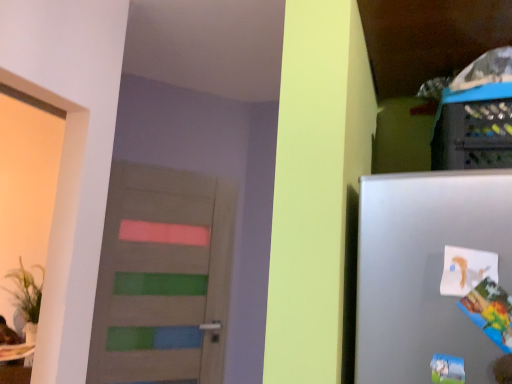
Question: Is wooden door with painted stripes at center to the left of colorful paper comic book at right from the viewer's perspective?

Choices:
 (A) no
 (B) yes

Answer: (B)

Question: From the image's perspective, is wooden door with painted stripes at center under colorful paper comic book at right?

Choices:
 (A) yes
 (B) no

Answer: (A)

Question: From a real-world perspective, is wooden door with painted stripes at center physically above colorful paper comic book at right?

Choices:
 (A) no
 (B) yes

Answer: (A)

Question: Does wooden door with painted stripes at center appear on the right side of colorful paper comic book at right?

Choices:
 (A) yes
 (B) no

Answer: (B)

Question: Would you say wooden door with painted stripes at center contains colorful paper comic book at right?

Choices:
 (A) yes
 (B) no

Answer: (B)

Question: From the image's perspective, is wooden door with painted stripes at center above colorful paper comic book at right?

Choices:
 (A) yes
 (B) no

Answer: (B)

Question: Is colorful paper comic book at right with wooden door with painted stripes at center?

Choices:
 (A) yes
 (B) no

Answer: (B)

Question: From a real-world perspective, is colorful paper comic book at right located higher than wooden door with painted stripes at center?

Choices:
 (A) yes
 (B) no

Answer: (A)

Question: Could you tell me if colorful paper comic book at right is facing wooden door with painted stripes at center?

Choices:
 (A) no
 (B) yes

Answer: (A)

Question: Considering the relative sizes of colorful paper comic book at right and wooden door with painted stripes at center in the image provided, is colorful paper comic book at right smaller than wooden door with painted stripes at center?

Choices:
 (A) no
 (B) yes

Answer: (B)

Question: Can you confirm if colorful paper comic book at right is shorter than wooden door with painted stripes at center?

Choices:
 (A) yes
 (B) no

Answer: (A)

Question: Is colorful paper comic book at right taller than wooden door with painted stripes at center?

Choices:
 (A) yes
 (B) no

Answer: (B)

Question: Considering the positions of wooden door with painted stripes at center and colorful paper comic book at right in the image, is wooden door with painted stripes at center taller or shorter than colorful paper comic book at right?

Choices:
 (A) tall
 (B) short

Answer: (A)